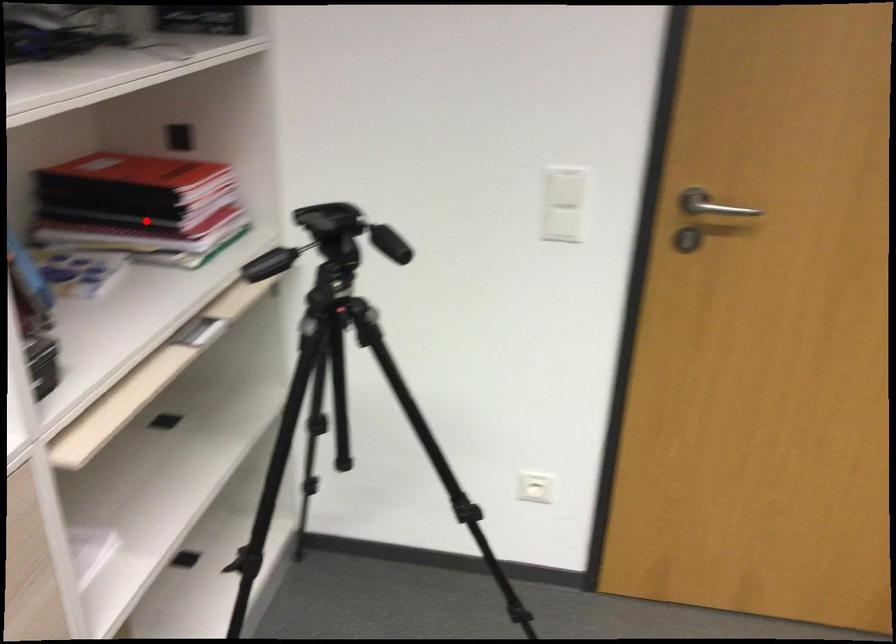
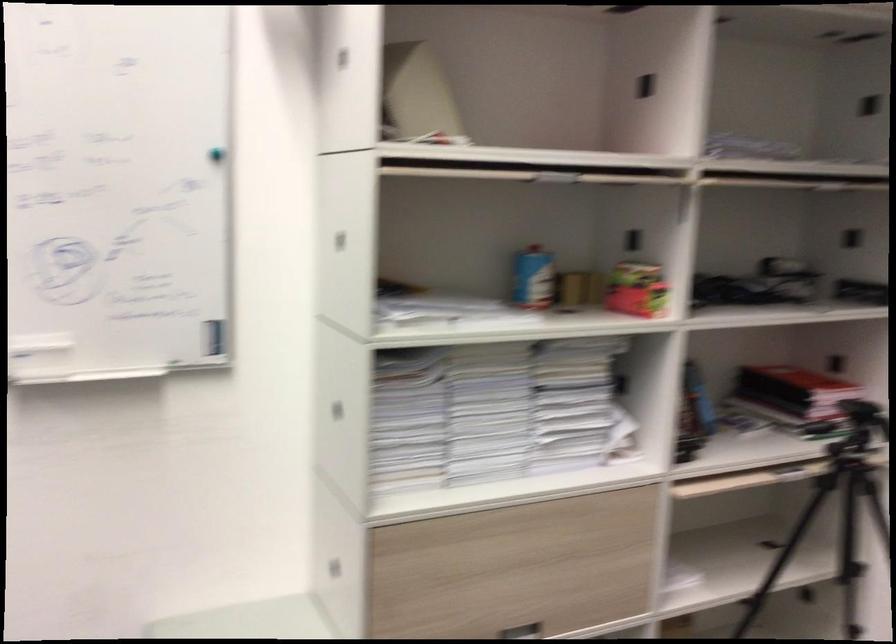
Question: I am providing you with two images of the same scene from different viewpoints. Given a red point in image1, look at the same physical point in image2. Is it:

Choices:
 (A) Closer to the viewpoint
 (B) Farther from the viewpoint

Answer: (B)